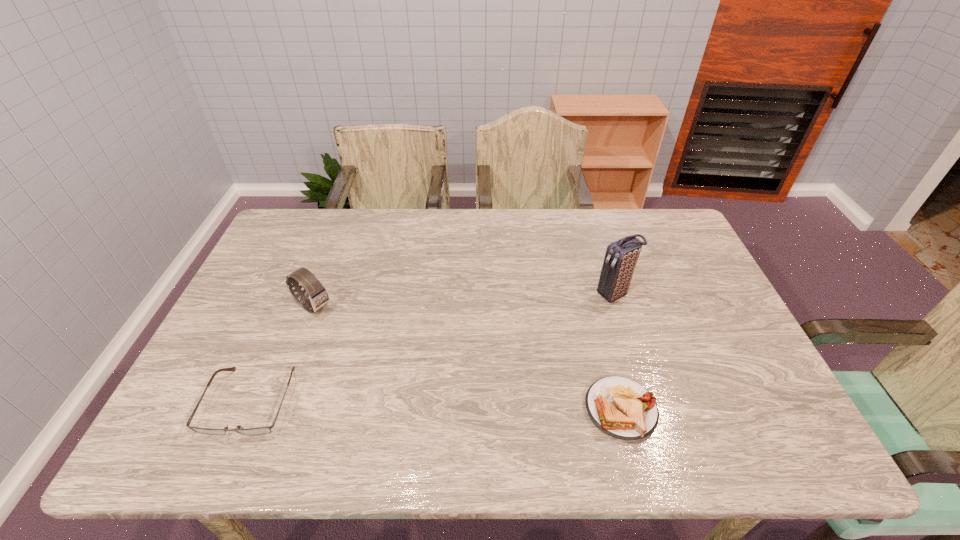
At what (x,y) coordinates should I click in order to perform the action: click on spectacles. Please return your answer as a coordinate pair (x, y). This screenshot has width=960, height=540. Looking at the image, I should click on (267, 429).

You are a GUI agent. You are given a task and a screenshot of the screen. Output one action in this format:
    pyautogui.click(x=<x>, y=<y>)
    Task: Click on the sandwich
    
    Given the screenshot: What is the action you would take?
    click(x=620, y=407)

Identify the location of watch. (316, 297).

Find the location of a particular element. This screenshot has height=540, width=960. the tallest object is located at coordinates (621, 256).

Where is `free spot located on the right of the sandwich`? This screenshot has width=960, height=540. free spot located on the right of the sandwich is located at coordinates (773, 409).

At what (x,y) coordinates should I click in order to perform the action: click on vacant region located on the face of the watch. Please return your answer as a coordinate pair (x, y). Looking at the image, I should click on (388, 359).

Locate an element on the screen. The height and width of the screenshot is (540, 960). free space located 0.340m on the face of the watch is located at coordinates (417, 379).

This screenshot has width=960, height=540. Identify the location of free spot located on the face of the watch. (399, 367).

You are a GUI agent. You are given a task and a screenshot of the screen. Output one action in this format:
    pyautogui.click(x=<x>, y=<y>)
    Task: Click on the free space located 0.110m with the zip open on the clutch bag
    This screenshot has height=540, width=960.
    Given the screenshot: What is the action you would take?
    pyautogui.click(x=569, y=314)

You are a GUI agent. You are given a task and a screenshot of the screen. Output one action in this format:
    pyautogui.click(x=<x>, y=<y>)
    Task: Click on the vacant area located with the zip open on the clutch bag
    
    Given the screenshot: What is the action you would take?
    pyautogui.click(x=516, y=340)